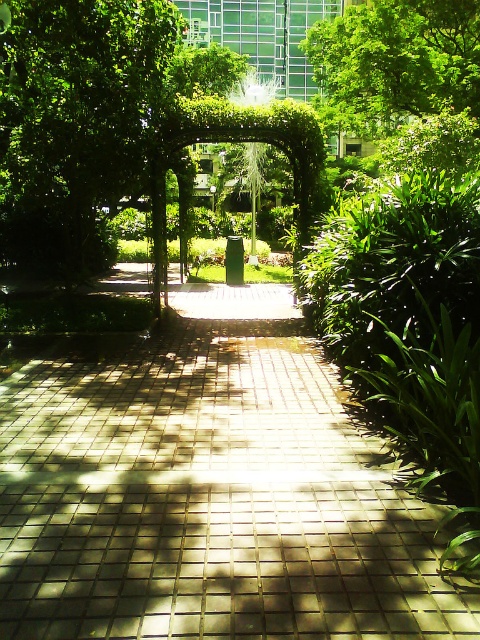
Is brick paved walkway at center further to camera compared to green leafy tree at center?

No, it is not.

Is brick paved walkway at center wider than green leafy tree at center?

Yes, brick paved walkway at center is wider than green leafy tree at center.

Is point (122, 564) more distant than point (106, 52)?

That is False.

This screenshot has height=640, width=480. I want to click on brick paved walkway at center, so click(x=208, y=490).

Can you confirm if green leafy tree at center is bigger than green leafy tree at upper center?

Actually, green leafy tree at center might be smaller than green leafy tree at upper center.

Consider the image. Between green leafy tree at center and green leafy tree at upper center, which one is positioned higher?

green leafy tree at upper center is higher up.

Is point (118, 10) farther from viewer compared to point (433, 76)?

No.

Identify the location of green leafy tree at center. This screenshot has width=480, height=640. (75, 122).

Who is shorter, brick paved walkway at center or green leafy tree at upper center?

Standing shorter between the two is brick paved walkway at center.

Describe the element at coordinates (208, 490) in the screenshot. I see `brick paved walkway at center` at that location.

Locate an element on the screen. The height and width of the screenshot is (640, 480). brick paved walkway at center is located at coordinates (208, 490).